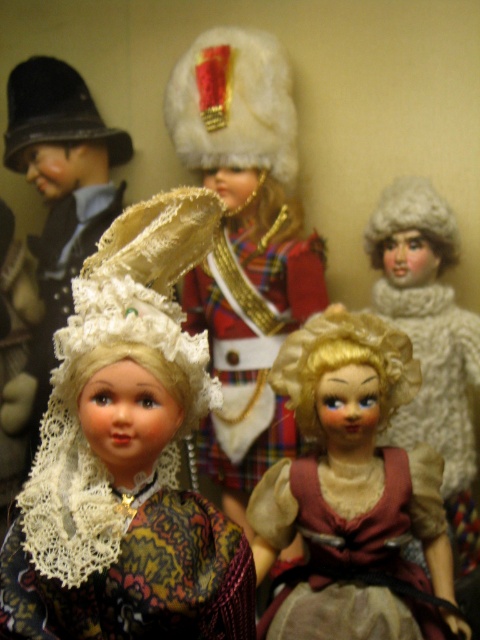
You are a curator arranging an exhibition and need to place a new display stand at coordinates point A. The display stand is 0.3 units wide. If the lace fabric doll at center is at point 0.713, 0.265, will the display stand fit without overlapping the doll?

The lace fabric doll at center is located at point (127, 456). Since the display stand is 0.3 units wide, it depends on the exact placement. However, without specific coordinates for point A, it is impossible to determine if there will be an overlap. Please provide the coordinates of point A for an accurate assessment.

You are a photographer setting up a shoot for a doll collection. You want to ensure that the lace fabric doll at center and the matte brown fabric doll at center are both in focus. Given that your camera can only sharply focus on objects at a single distance, which doll should you focus on to ensure both are in focus?

You should focus on the lace fabric doll at center since it is closer to the viewer than the matte brown fabric doll at center. By focusing on the closer object, the depth of field may extend to include the farther object in acceptable focus.